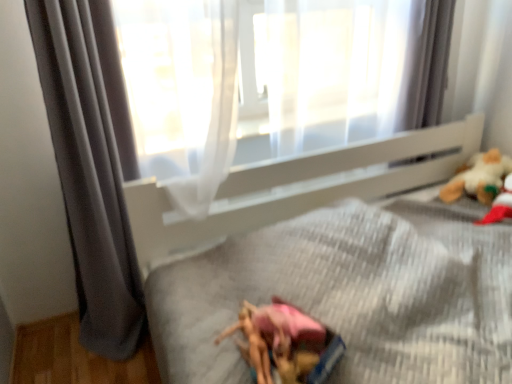
Measure the distance between gray fabric curtain at left and camera.

The distance of gray fabric curtain at left from camera is 3.93 feet.

What do you see at coordinates (88, 176) in the screenshot?
I see `gray fabric curtain at left` at bounding box center [88, 176].

Find the location of a particular element. gray fabric curtain at left is located at coordinates (88, 176).

Measure the distance between point (40, 44) and camera.

They are 4.14 feet apart.

The height and width of the screenshot is (384, 512). What do you see at coordinates (479, 177) in the screenshot?
I see `white plush bear at upper right` at bounding box center [479, 177].

Measure the distance between white plush bear at upper right and camera.

5.83 feet.

Locate an element on the screen. This screenshot has height=384, width=512. white plush bear at upper right is located at coordinates (479, 177).

The height and width of the screenshot is (384, 512). I want to click on gray fabric curtain at left, so click(88, 176).

Which is more to the right, gray fabric curtain at left or white plush bear at upper right?

From the viewer's perspective, white plush bear at upper right appears more on the right side.

Is the position of gray fabric curtain at left less distant than that of white plush bear at upper right?

Yes, gray fabric curtain at left is in front of white plush bear at upper right.

Considering the points (86, 265) and (469, 170), which point is behind, point (86, 265) or point (469, 170)?

Positioned behind is point (469, 170).

From the picture: From the image's perspective, relative to white plush bear at upper right, is gray fabric curtain at left above or below?

gray fabric curtain at left is below white plush bear at upper right.

From a real-world perspective, is gray fabric curtain at left under white plush bear at upper right?

Actually, gray fabric curtain at left is physically above white plush bear at upper right in the real world.

Does gray fabric curtain at left have a greater width compared to white plush bear at upper right?

Incorrect, the width of gray fabric curtain at left does not surpass that of white plush bear at upper right.

Between gray fabric curtain at left and white plush bear at upper right, which one has less height?

Standing shorter between the two is white plush bear at upper right.

Is gray fabric curtain at left bigger or smaller than white plush bear at upper right?

Clearly, gray fabric curtain at left is larger in size than white plush bear at upper right.

Is white plush bear at upper right completely or partially inside gray fabric curtain at left?

No, white plush bear at upper right is located outside of gray fabric curtain at left.

Is gray fabric curtain at left far away from white plush bear at upper right?

Absolutely, gray fabric curtain at left is distant from white plush bear at upper right.

Is gray fabric curtain at left facing towards white plush bear at upper right?

No, gray fabric curtain at left is not turned towards white plush bear at upper right.

How different are the orientations of gray fabric curtain at left and white plush bear at upper right in degrees?

The angle between the facing direction of gray fabric curtain at left and the facing direction of white plush bear at upper right is 91 degrees.

The image size is (512, 384). What are the coordinates of `curtain in front of the white plush bear at upper right` in the screenshot? It's located at (88, 176).

Does white plush bear at upper right appear on the left side of gray fabric curtain at left?

No, white plush bear at upper right is not to the left of gray fabric curtain at left.

In the image, is white plush bear at upper right positioned in front of or behind gray fabric curtain at left?

white plush bear at upper right is behind gray fabric curtain at left.

Does point (445, 198) come farther from viewer compared to point (42, 28)?

That is True.

From the image's perspective, which is below, white plush bear at upper right or gray fabric curtain at left?

gray fabric curtain at left, from the image's perspective.

From the picture: From a real-world perspective, is white plush bear at upper right on top of gray fabric curtain at left?

No, from a real-world perspective, white plush bear at upper right is not over gray fabric curtain at left

Does white plush bear at upper right have a lesser width compared to gray fabric curtain at left?

No, white plush bear at upper right is not thinner than gray fabric curtain at left.

Between white plush bear at upper right and gray fabric curtain at left, which one has less height?

white plush bear at upper right is shorter.

Who is bigger, white plush bear at upper right or gray fabric curtain at left?

gray fabric curtain at left is bigger.

Is white plush bear at upper right inside the boundaries of gray fabric curtain at left, or outside?

white plush bear at upper right is outside gray fabric curtain at left.

Is white plush bear at upper right next to gray fabric curtain at left and touching it?

white plush bear at upper right and gray fabric curtain at left are clearly separated.

Is gray fabric curtain at left at the back of white plush bear at upper right?

white plush bear at upper right does not have its back to gray fabric curtain at left.

Find the location of `curtain that is below the white plush bear at upper right (from the image's perspective)`. curtain that is below the white plush bear at upper right (from the image's perspective) is located at coordinates tap(88, 176).

This screenshot has height=384, width=512. In the image, there is a gray fabric curtain at left. What are the coordinates of `toy below it (from a real-world perspective)` in the screenshot? It's located at (479, 177).

You are a GUI agent. You are given a task and a screenshot of the screen. Output one action in this format:
    pyautogui.click(x=<x>, y=<y>)
    Task: Click on the curtain that appears below the white plush bear at upper right (from the image's perspective)
    Image resolution: width=512 pixels, height=384 pixels.
    Given the screenshot: What is the action you would take?
    pyautogui.click(x=88, y=176)